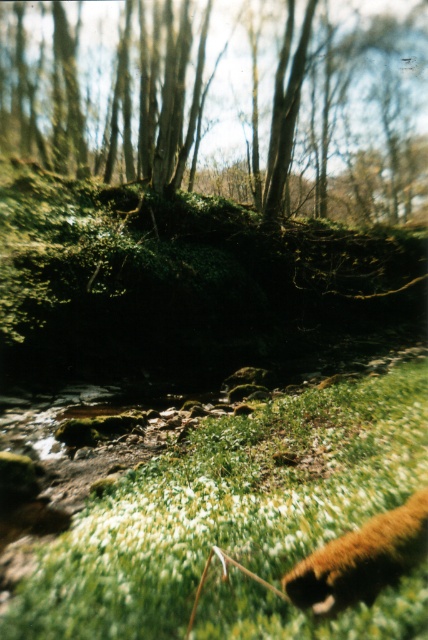
Question: Which object appears closest to the camera in this image?

Choices:
 (A) green grassy at lower center
 (B) green mossy tree at upper center
 (C) brown furry animal at lower right

Answer: (A)

Question: Which point is closer to the camera?

Choices:
 (A) (329, 600)
 (B) (168, 132)

Answer: (A)

Question: Which of the following is the farthest from the observer?

Choices:
 (A) green mossy tree at upper center
 (B) green grassy at lower center

Answer: (A)

Question: Can you confirm if green mossy tree at upper center is thinner than brown furry animal at lower right?

Choices:
 (A) yes
 (B) no

Answer: (B)

Question: Does green grassy at lower center have a smaller size compared to brown furry animal at lower right?

Choices:
 (A) no
 (B) yes

Answer: (B)

Question: In this image, where is green mossy tree at upper center located relative to brown furry animal at lower right?

Choices:
 (A) left
 (B) right

Answer: (B)